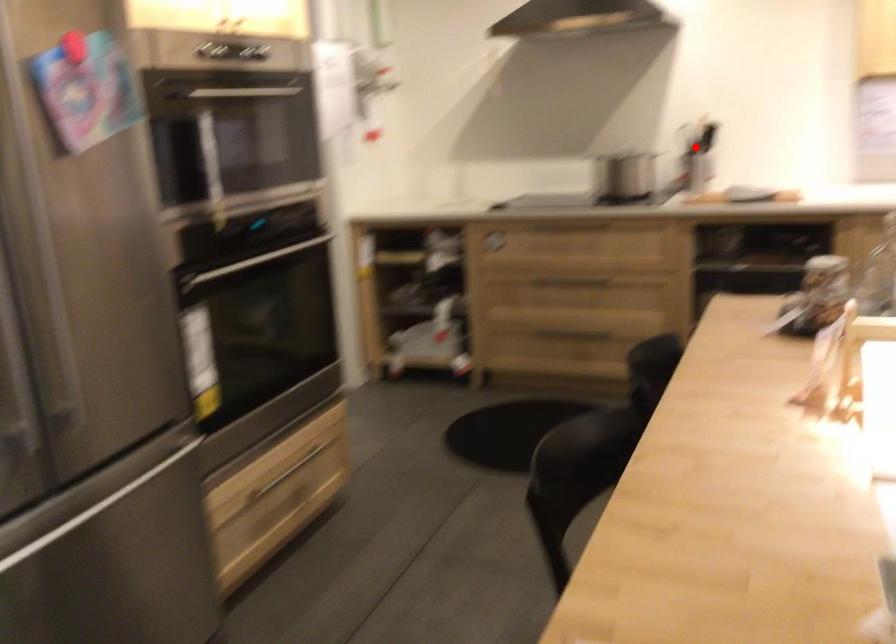
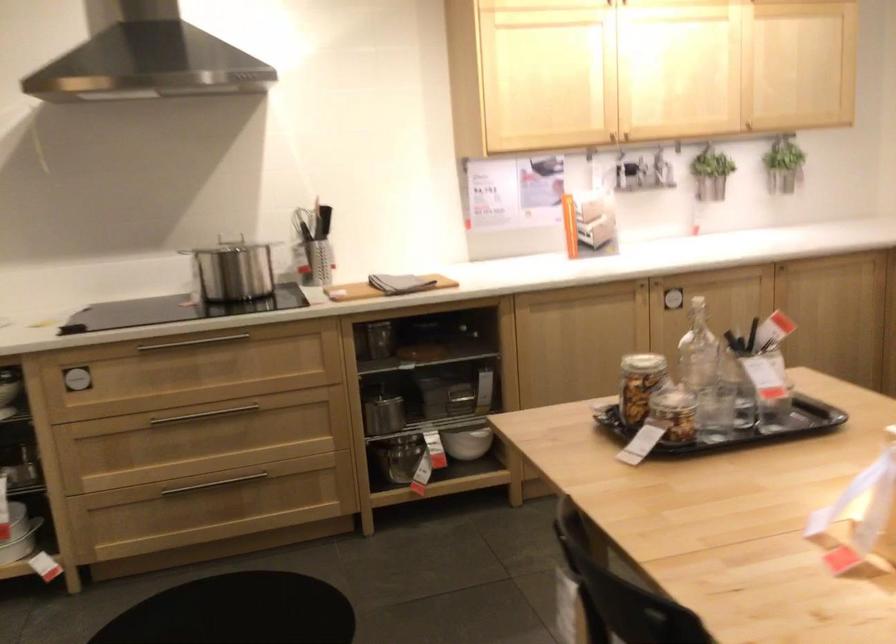
The point at the highlighted location is marked in the first image. Where is the corresponding point in the second image?

(313, 245)